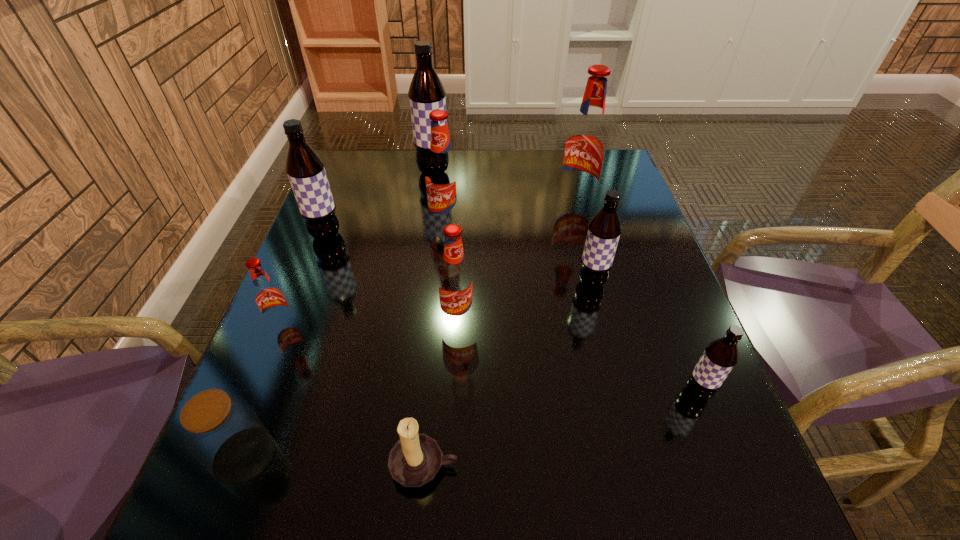
I want to click on vacant space at the left edge of the desktop, so click(x=301, y=321).

Locate an element on the screen. The height and width of the screenshot is (540, 960). free space at the right edge of the desktop is located at coordinates (670, 316).

The height and width of the screenshot is (540, 960). Identify the location of vacant region at the far left corner of the desktop. (380, 168).

Identify the location of vacant space at the near left corner of the desktop. (242, 502).

Find the location of `free region at the near right corner of the desktop`. free region at the near right corner of the desktop is located at coordinates [x=661, y=483].

Where is `free space between the third smallest red root beer and the leftmost red root beer`? free space between the third smallest red root beer and the leftmost red root beer is located at coordinates (365, 275).

This screenshot has height=540, width=960. I want to click on free spot between the jar and the nearest brown root beer, so click(x=470, y=424).

You are a GUI agent. You are given a task and a screenshot of the screen. Output one action in this format:
    pyautogui.click(x=<x>, y=<y>)
    Task: Click on the free space between the second farthest brown root beer and the smallest brown root beer
    This screenshot has width=960, height=540.
    Given the screenshot: What is the action you would take?
    pyautogui.click(x=512, y=314)

Locate an element on the screen. unoccupied area between the leftmost brown root beer and the brown jar is located at coordinates point(285,346).

Locate an element on the screen. Image resolution: width=960 pixels, height=540 pixels. free space between the brown jar and the third biggest red root beer is located at coordinates pos(350,387).